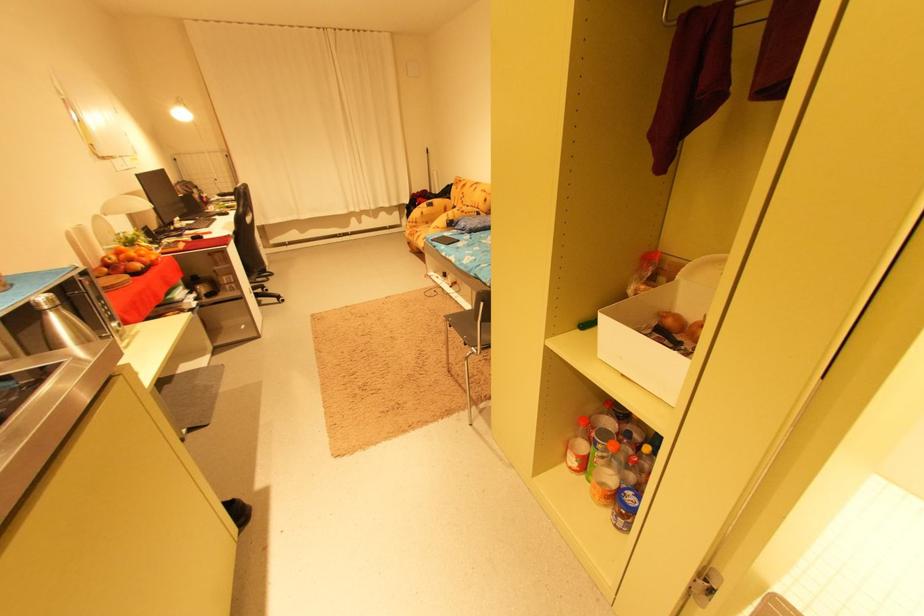
Which object does [128,264] point to?

It refers to a red apple.